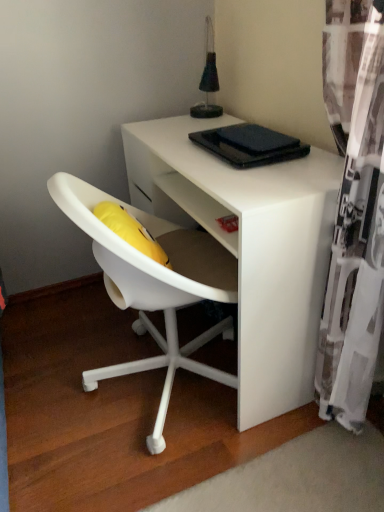
The height and width of the screenshot is (512, 384). Identify the location of vacant space that is to the left of black matte pad at upper center. (191, 154).